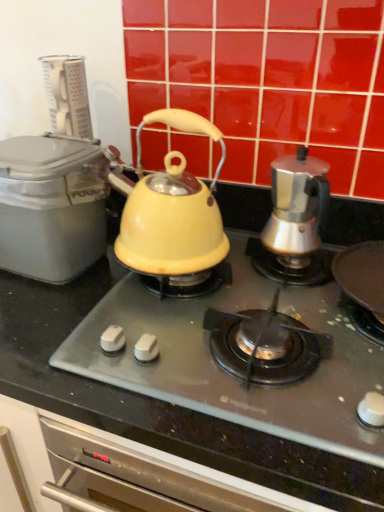
Image resolution: width=384 pixels, height=512 pixels. Identify the location of free spot above matte gray container at left (from a real-world perspective). (35, 143).